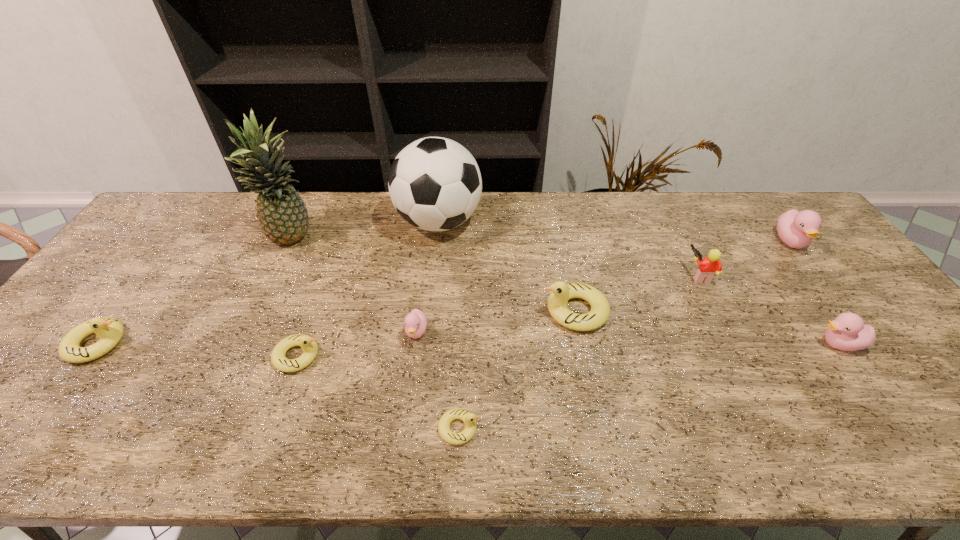
The image size is (960, 540). Find the location of `pink duckling that is the second nearest to the fifth duckling from left to right`. pink duckling that is the second nearest to the fifth duckling from left to right is located at coordinates (847, 332).

Identify the location of yellow duckling that stands as the fourth closest to the second biggest pink duckling. The height and width of the screenshot is (540, 960). (110, 331).

Where is `yellow duckling that can be found as the closest to the smallest pink duckling`? yellow duckling that can be found as the closest to the smallest pink duckling is located at coordinates (468, 418).

Image resolution: width=960 pixels, height=540 pixels. Identify the location of vacant region that satisfies the following two spatial constraints: 1. on the front side of the green pineapple; 2. on the face of the leftmost object. (247, 343).

What are the coordinates of `vacant space that satisfies the following two spatial constraints: 1. on the front-facing side of the smallest pink duckling; 2. on the face of the third biggest yellow duckling` in the screenshot? It's located at (414, 356).

Where is `free space that satisfies the following two spatial constraints: 1. on the front-facing side of the leftmost pink duckling; 2. on the face of the leftmost yellow duckling`? This screenshot has height=540, width=960. free space that satisfies the following two spatial constraints: 1. on the front-facing side of the leftmost pink duckling; 2. on the face of the leftmost yellow duckling is located at coordinates (416, 343).